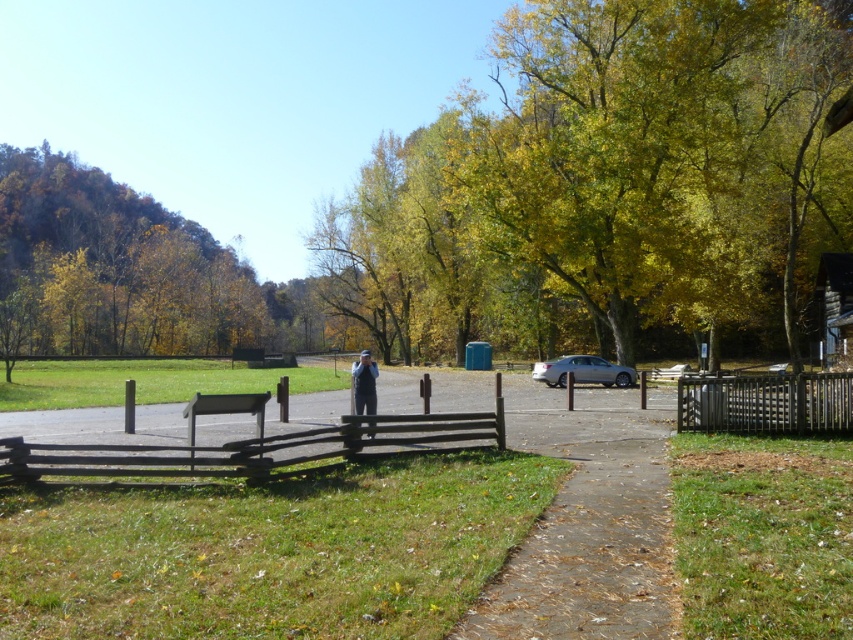
Between yellow-green leaves at center and wooden fence at center, which one has less height?

With less height is wooden fence at center.

Is point (605, 205) positioned before point (26, 454)?

No, (605, 205) is further to viewer.

Is point (631, 323) positioned in front of point (161, 449)?

That is False.

This screenshot has height=640, width=853. I want to click on yellow-green leaves at center, so click(x=608, y=180).

Who is shorter, gravelly concrete path at center or green leafy trees at upper left?

Standing shorter between the two is gravelly concrete path at center.

Can you confirm if gravelly concrete path at center is positioned to the right of green leafy trees at upper left?

Correct, you'll find gravelly concrete path at center to the right of green leafy trees at upper left.

Image resolution: width=853 pixels, height=640 pixels. What do you see at coordinates (587, 520) in the screenshot?
I see `gravelly concrete path at center` at bounding box center [587, 520].

This screenshot has width=853, height=640. In order to click on gravelly concrete path at center in this screenshot , I will do `click(587, 520)`.

Which of these two, wooden fence at center or black wooden fence at right, stands taller?

wooden fence at center is taller.

Measure the distance from wooden fence at center to black wooden fence at right.

They are 9.96 meters apart.

Which is behind, point (177, 419) or point (792, 422)?

The point (177, 419) is behind.

Where is `wooden fence at center`? The image size is (853, 640). wooden fence at center is located at coordinates (227, 438).